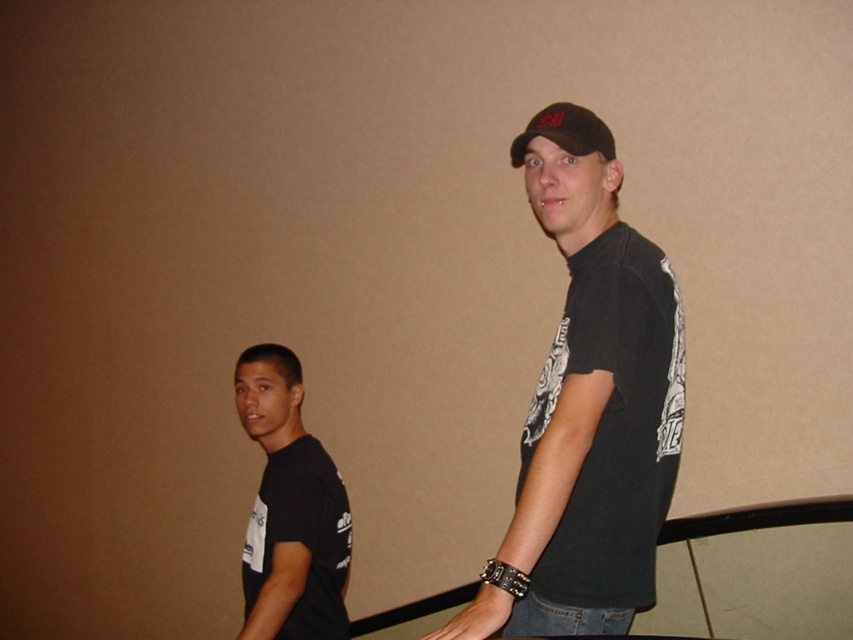
Question: Can you confirm if black matte t-shirt at center is positioned to the left of black matte t-shirt at left?

Choices:
 (A) yes
 (B) no

Answer: (B)

Question: In this image, where is black matte t-shirt at center located relative to black matte t-shirt at left?

Choices:
 (A) below
 (B) above

Answer: (B)

Question: Where is black matte t-shirt at center located in relation to black matte t-shirt at left in the image?

Choices:
 (A) above
 (B) below

Answer: (A)

Question: Which object appears farthest from the camera in this image?

Choices:
 (A) black matte t-shirt at left
 (B) black matte t-shirt at center

Answer: (A)

Question: Which of the following is the closest to the observer?

Choices:
 (A) (248, 540)
 (B) (619, 596)

Answer: (B)